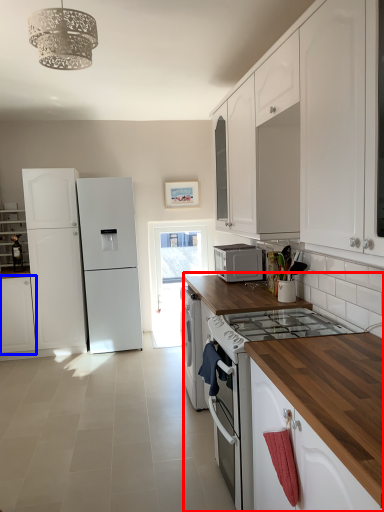
Question: Which object is further to the camera taking this photo, countertop (highlighted by a red box) or cabinetry (highlighted by a blue box)?

Choices:
 (A) countertop
 (B) cabinetry

Answer: (B)